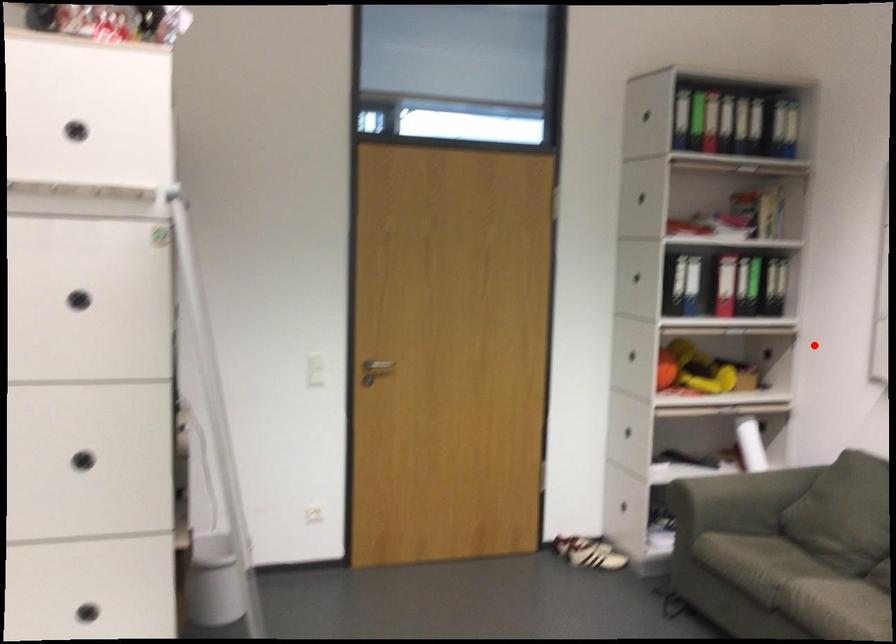
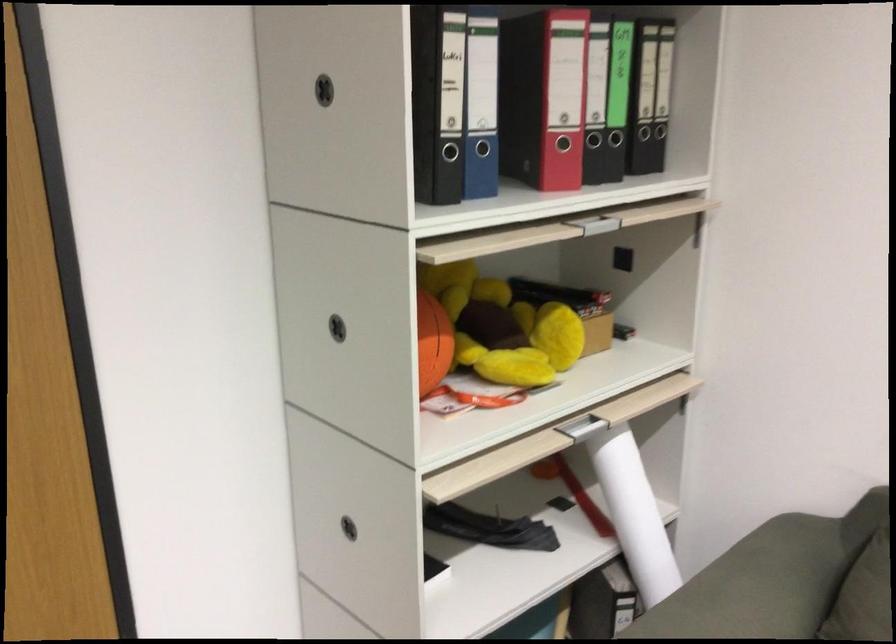
Locate, in the second image, the point that corresponds to the highlighted location in the first image.

(743, 260)